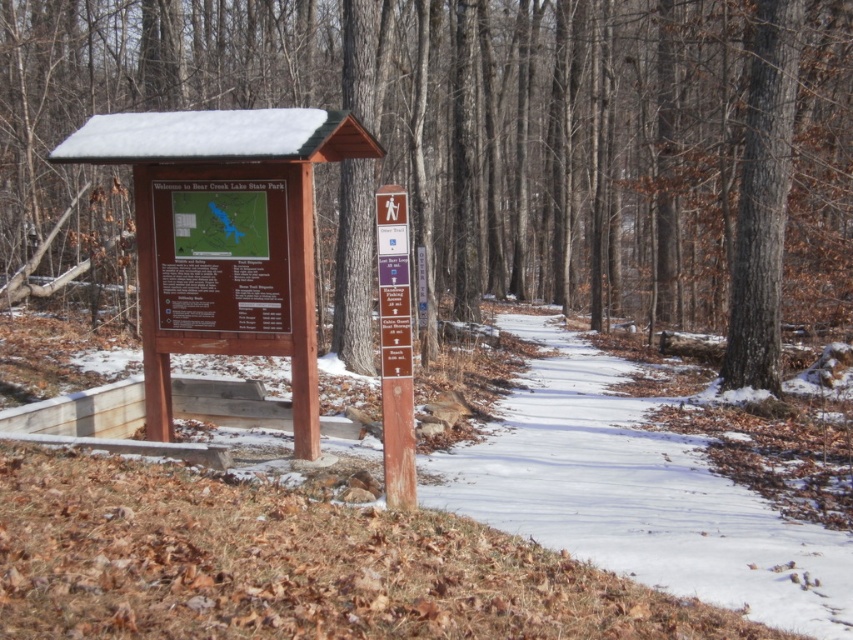
Question: Estimate the real-world distances between objects in this image. Which object is farther from the brown wood tree at center?

Choices:
 (A) wooden signpost at center
 (B) snowy dirt path at center

Answer: (A)

Question: Can you confirm if brown wood tree at center is positioned to the left of wooden signpost at center?

Choices:
 (A) no
 (B) yes

Answer: (A)

Question: Which is farther from the snowy dirt path at center?

Choices:
 (A) brown wood tree at center
 (B) wooden signpost at center

Answer: (A)

Question: Which point appears closest to the camera in this image?

Choices:
 (A) (392, 464)
 (B) (656, 531)
 (C) (788, 76)

Answer: (A)

Question: Is brown wood tree at center to the left of wooden signpost at center from the viewer's perspective?

Choices:
 (A) yes
 (B) no

Answer: (B)

Question: Does brown wood tree at center appear under wooden signpost at center?

Choices:
 (A) no
 (B) yes

Answer: (A)